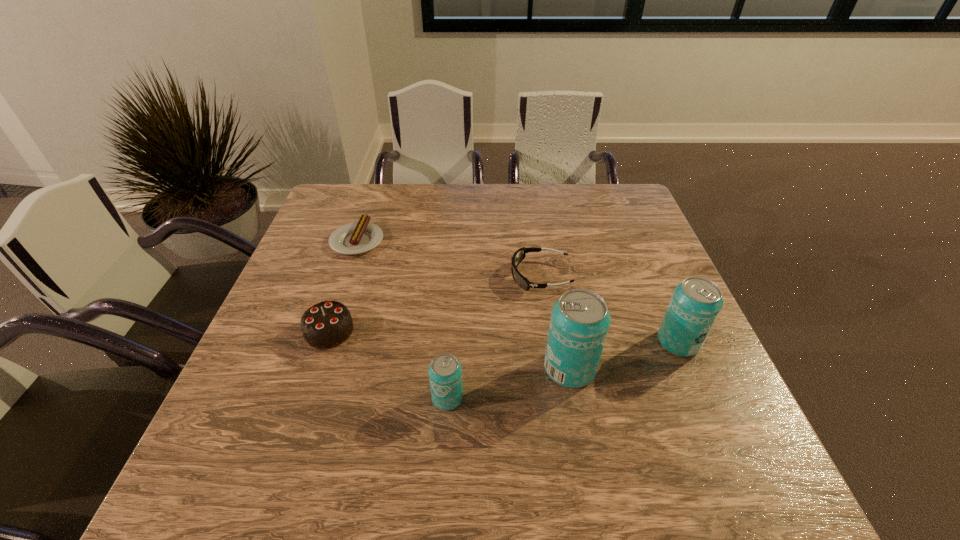
This screenshot has height=540, width=960. In order to click on vacant area situated 0.240m on the left of the second shortest beer can in this screenshot , I will do `click(551, 342)`.

This screenshot has width=960, height=540. In order to click on vacant area situated 0.370m on the front and sides of the second shortest object in this screenshot , I will do `click(371, 276)`.

Where is `free space located 0.270m on the front and sides of the second shortest object`? This screenshot has width=960, height=540. free space located 0.270m on the front and sides of the second shortest object is located at coordinates (408, 276).

This screenshot has width=960, height=540. Identify the location of free spot located 0.300m on the front and sides of the second shortest object. coord(396,276).

You are a GUI agent. You are given a task and a screenshot of the screen. Output one action in this format:
    pyautogui.click(x=<x>, y=<y>)
    Task: Click on the free location located 0.150m on the back of the sausage
    Image resolution: width=960 pixels, height=540 pixels.
    Given the screenshot: What is the action you would take?
    pyautogui.click(x=372, y=197)

Locate an element on the screen. The width and height of the screenshot is (960, 540). vacant point located on the back of the fourth tallest object is located at coordinates point(348,275).

Locate an element on the screen. The image size is (960, 540). object that is positioned at the far edge is located at coordinates (358, 237).

This screenshot has width=960, height=540. In order to click on object that is at the near edge in this screenshot , I will do `click(445, 372)`.

Find the location of a particular element. sausage located at the left edge is located at coordinates (358, 237).

At what (x,y) coordinates should I click in order to perform the action: click on chocolate cake at the left edge. Please return your answer as a coordinate pair (x, y). Image resolution: width=960 pixels, height=540 pixels. Looking at the image, I should click on pyautogui.click(x=327, y=324).